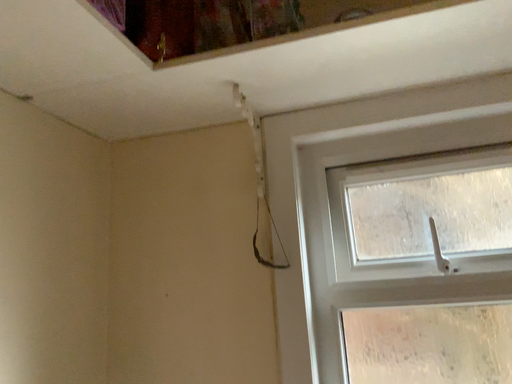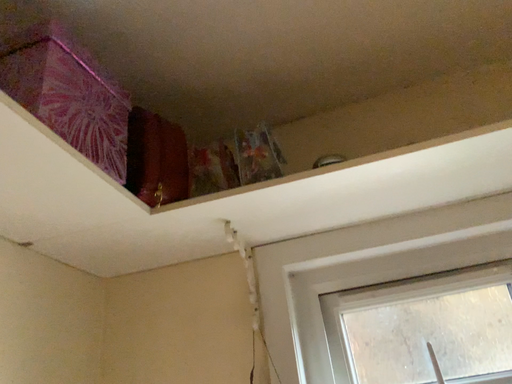
Question: Which way did the camera rotate in the video?

Choices:
 (A) rotated upward
 (B) rotated downward

Answer: (A)